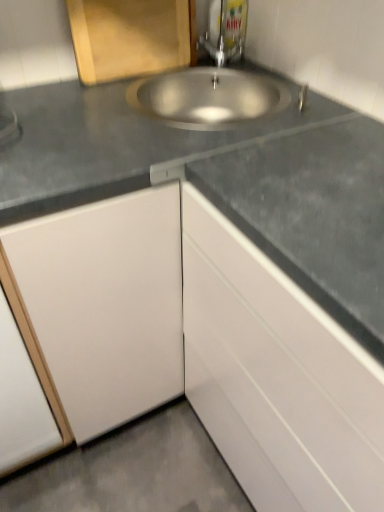
Locate an element on the screen. The width and height of the screenshot is (384, 512). blank space situated above white glossy cabinet at lower right, positioned as the 2th cabinetry in top-to-bottom order (from a real-world perspective) is located at coordinates (331, 177).